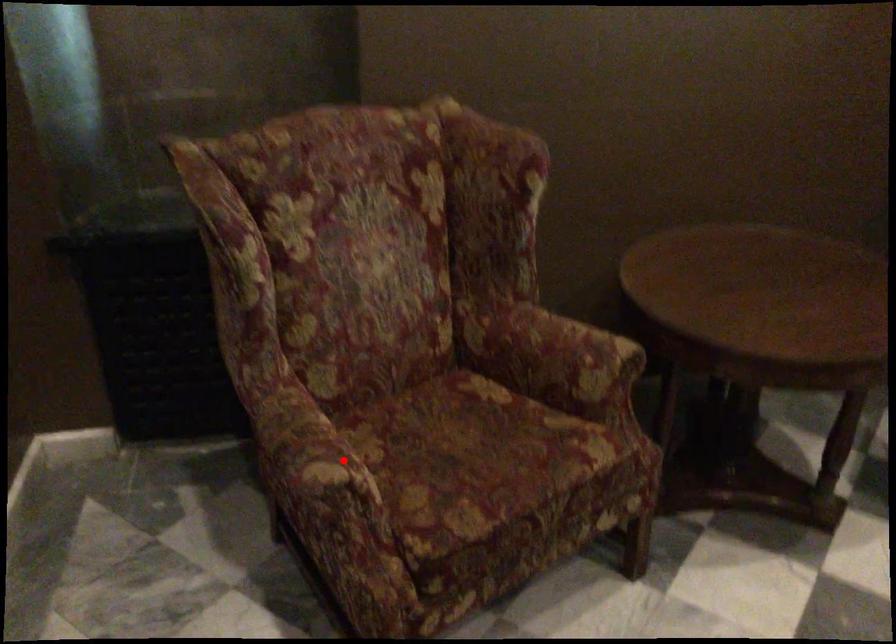
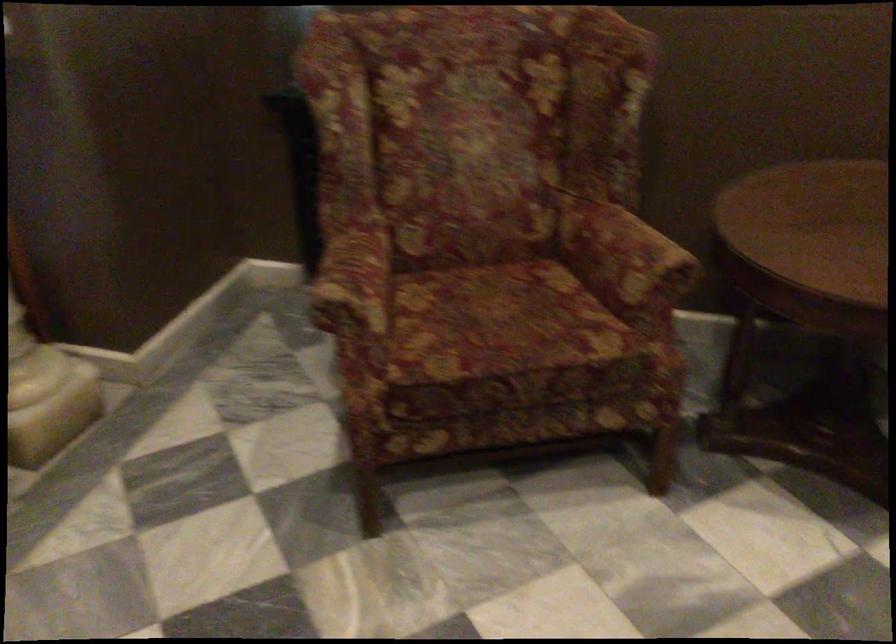
The point at the highlighted location is marked in the first image. Where is the corresponding point in the second image?

(355, 286)